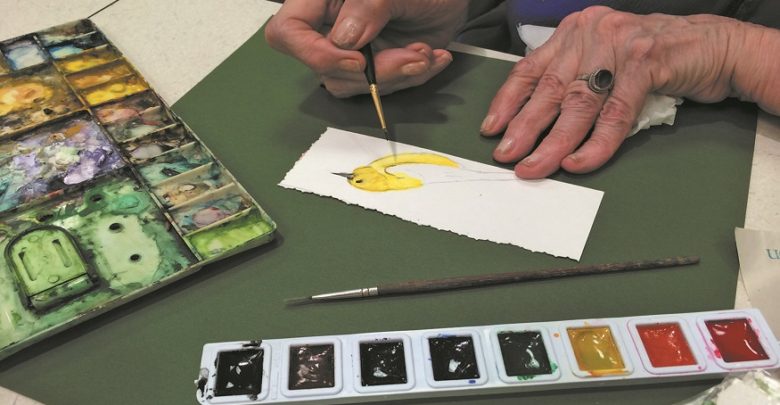
Locate an element on the screen. red paint is located at coordinates (746, 344).